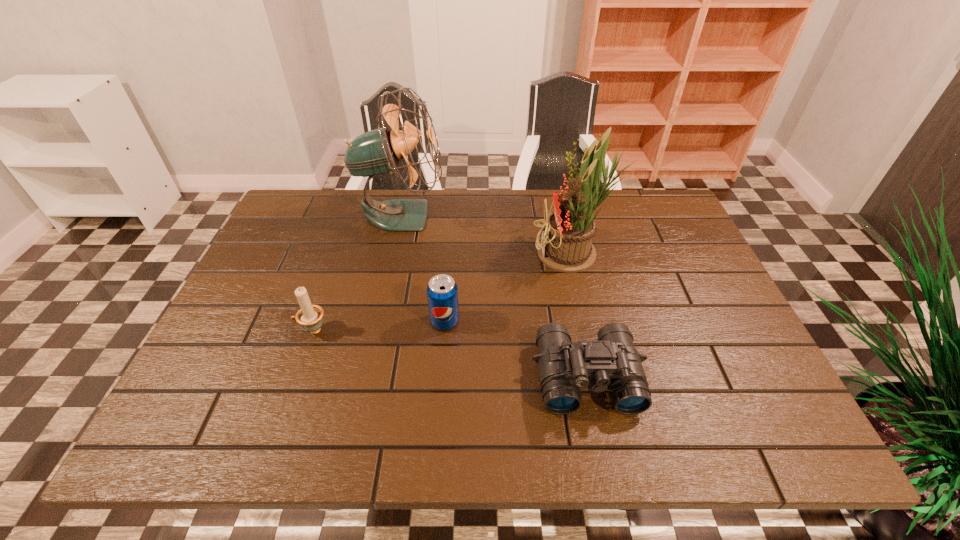
In the image, there is a desktop. Identify the location of free space at the far right corner. The width and height of the screenshot is (960, 540). (628, 193).

Identify the location of free area in between the pop soda and the binoculars. The height and width of the screenshot is (540, 960). (516, 349).

This screenshot has width=960, height=540. What are the coordinates of `free spot between the binoculars and the pop soda` in the screenshot? It's located at (516, 349).

The height and width of the screenshot is (540, 960). In order to click on vacant space that's between the binoculars and the fan in this screenshot , I will do `click(494, 296)`.

The height and width of the screenshot is (540, 960). I want to click on vacant area that lies between the pop soda and the flower arrangement, so click(509, 288).

You are a GUI agent. You are given a task and a screenshot of the screen. Output one action in this format:
    pyautogui.click(x=<x>, y=<y>)
    Task: Click on the free point between the flower arrangement and the pop soda
    The width and height of the screenshot is (960, 540).
    Given the screenshot: What is the action you would take?
    pyautogui.click(x=509, y=288)

Find the location of a particular element. free point between the binoculars and the flower arrangement is located at coordinates (580, 315).

Locate an element on the screen. the third closest object to the nearest object is located at coordinates (378, 151).

Find the location of a particular element. The image size is (960, 540). object that is the third nearest to the nearest object is located at coordinates (378, 151).

This screenshot has width=960, height=540. What are the coordinates of `vacant space that satisfies the following two spatial constraints: 1. on the front side of the pop soda; 2. on the handle side of the candle_holder` in the screenshot? It's located at (444, 330).